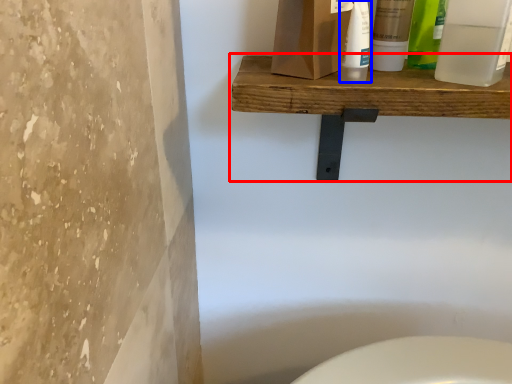
Question: Which of the following is the farthest to the observer, shelf (highlighted by a red box) or cleaning product (highlighted by a blue box)?

Choices:
 (A) shelf
 (B) cleaning product

Answer: (B)